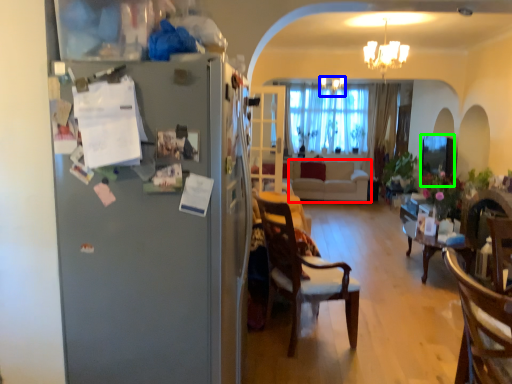
Question: Considering the real-world distances, which object is closest to studio couch (highlighted by a red box)? light fixture (highlighted by a blue box) or window screen (highlighted by a green box).

Choices:
 (A) light fixture
 (B) window screen

Answer: (B)